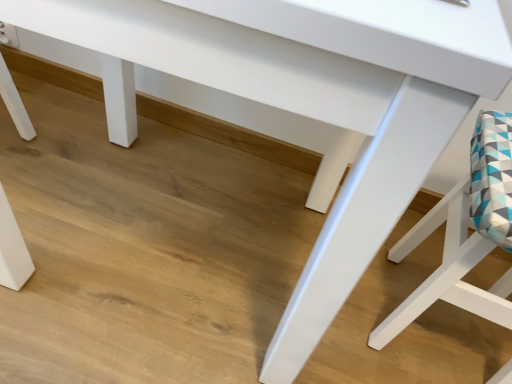
Locate an element on the screen. vacant area situated below white glossy chair at lower right (from a real-world perspective) is located at coordinates (437, 332).